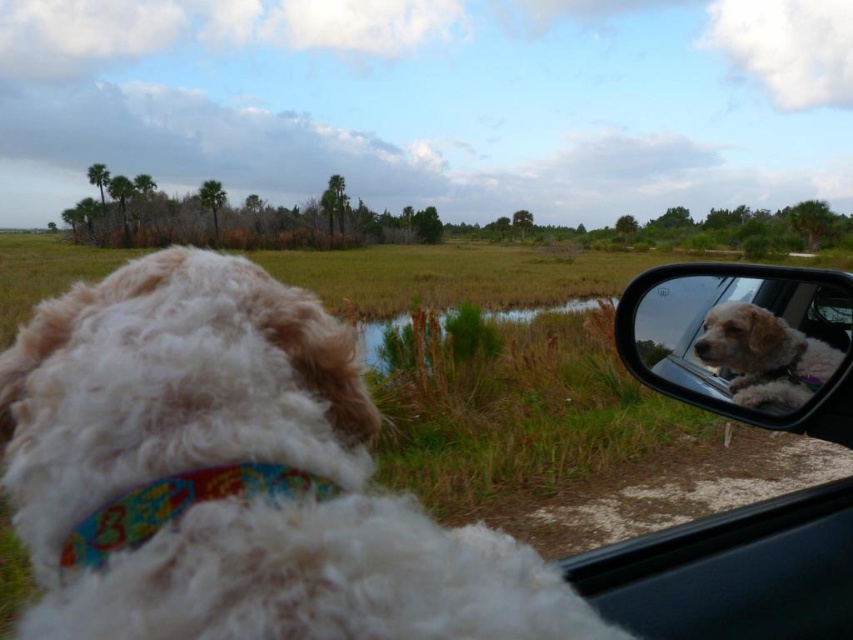
Question: Among these objects, which one is farthest from the camera?

Choices:
 (A) multicolored fabric neckband at lower left
 (B) white fluffy dog at right
 (C) matte plastic mirror at upper right
 (D) white fluffy dog at left

Answer: (B)

Question: Which point is farther to the camera?

Choices:
 (A) (105, 548)
 (B) (782, 376)

Answer: (B)

Question: Which object appears closest to the camera in this image?

Choices:
 (A) multicolored fabric neckband at lower left
 (B) white fluffy dog at left

Answer: (B)

Question: Is white fluffy dog at left closer to the viewer compared to multicolored fabric neckband at lower left?

Choices:
 (A) yes
 (B) no

Answer: (A)

Question: Can you confirm if white fluffy dog at left is positioned to the right of white fluffy dog at right?

Choices:
 (A) yes
 (B) no

Answer: (B)

Question: Considering the relative positions of white fluffy dog at left and multicolored fabric neckband at lower left in the image provided, where is white fluffy dog at left located with respect to multicolored fabric neckband at lower left?

Choices:
 (A) below
 (B) above

Answer: (B)